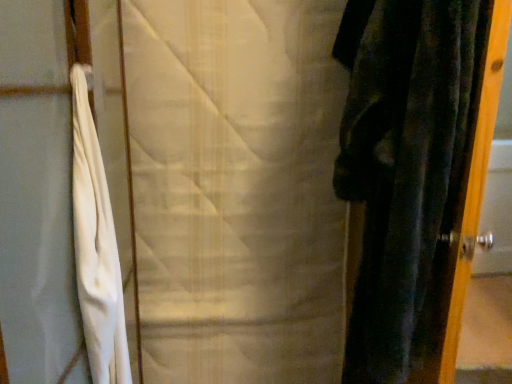
Locate an element on the screen. Image resolution: width=512 pixels, height=384 pixels. white textured fabric at center, which ranks as the 1th curtain in left-to-right order is located at coordinates (236, 189).

Describe the element at coordinates (236, 189) in the screenshot. The width and height of the screenshot is (512, 384). I see `white textured fabric at center, the second curtain when ordered from right to left` at that location.

Describe the element at coordinates (406, 171) in the screenshot. Image resolution: width=512 pixels, height=384 pixels. I see `velvet dark green curtain at right, the second curtain from the left` at that location.

How much space does velvet dark green curtain at right, which is the 1th curtain from right to left, occupy horizontally?

It is 4.70 inches.

What is the approximate height of velvet dark green curtain at right, the second curtain from the left?

velvet dark green curtain at right, the second curtain from the left, is 1.51 meters in height.

The image size is (512, 384). In order to click on velvet dark green curtain at right, which is the 1th curtain from right to left in this screenshot , I will do `click(406, 171)`.

Where is `white textured fabric at center, the second curtain when ordered from right to left`? The width and height of the screenshot is (512, 384). white textured fabric at center, the second curtain when ordered from right to left is located at coordinates (236, 189).

Which is more to the left, velvet dark green curtain at right, which is the 1th curtain from right to left, or white textured fabric at center, which ranks as the 1th curtain in left-to-right order?

Positioned to the left is white textured fabric at center, which ranks as the 1th curtain in left-to-right order.

Considering the positions of objects velvet dark green curtain at right, which is the 1th curtain from right to left, and white textured fabric at center, the second curtain when ordered from right to left, in the image provided, who is behind, velvet dark green curtain at right, which is the 1th curtain from right to left, or white textured fabric at center, the second curtain when ordered from right to left,?

white textured fabric at center, the second curtain when ordered from right to left, is more distant.

Considering the positions of points (420, 346) and (187, 322), is point (420, 346) farther from camera compared to point (187, 322)?

No, (420, 346) is closer to viewer.

From the picture: From the image's perspective, relative to white textured fabric at center, the second curtain when ordered from right to left, is velvet dark green curtain at right, which is the 1th curtain from right to left, above or below?

Based on their image positions, velvet dark green curtain at right, which is the 1th curtain from right to left, is located beneath white textured fabric at center, the second curtain when ordered from right to left.

From a real-world perspective, is velvet dark green curtain at right, the second curtain from the left, above or below white textured fabric at center, which ranks as the 1th curtain in left-to-right order?

velvet dark green curtain at right, the second curtain from the left, is situated higher than white textured fabric at center, which ranks as the 1th curtain in left-to-right order, in the real world.

Considering the relative sizes of velvet dark green curtain at right, which is the 1th curtain from right to left, and white textured fabric at center, the second curtain when ordered from right to left, in the image provided, is velvet dark green curtain at right, which is the 1th curtain from right to left, wider than white textured fabric at center, the second curtain when ordered from right to left,?

Indeed, velvet dark green curtain at right, which is the 1th curtain from right to left, has a greater width compared to white textured fabric at center, the second curtain when ordered from right to left.

In terms of height, does velvet dark green curtain at right, which is the 1th curtain from right to left, look taller or shorter compared to white textured fabric at center, the second curtain when ordered from right to left?

Considering their sizes, velvet dark green curtain at right, which is the 1th curtain from right to left, has more height than white textured fabric at center, the second curtain when ordered from right to left.

Considering the relative sizes of velvet dark green curtain at right, which is the 1th curtain from right to left, and white textured fabric at center, the second curtain when ordered from right to left, in the image provided, is velvet dark green curtain at right, which is the 1th curtain from right to left, smaller than white textured fabric at center, the second curtain when ordered from right to left,?

Yes.

Is white textured fabric at center, the second curtain when ordered from right to left, located within velvet dark green curtain at right, the second curtain from the left?

No, white textured fabric at center, the second curtain when ordered from right to left, is located outside of velvet dark green curtain at right, the second curtain from the left.

Is velvet dark green curtain at right, which is the 1th curtain from right to left, next to white textured fabric at center, the second curtain when ordered from right to left, and touching it?

velvet dark green curtain at right, which is the 1th curtain from right to left, is not next to white textured fabric at center, the second curtain when ordered from right to left, and they're not touching.

Is velvet dark green curtain at right, the second curtain from the left, looking in the opposite direction of white textured fabric at center, which ranks as the 1th curtain in left-to-right order?

Correct, velvet dark green curtain at right, the second curtain from the left, is looking away from white textured fabric at center, which ranks as the 1th curtain in left-to-right order.

Can you tell me how much velvet dark green curtain at right, the second curtain from the left, and white textured fabric at center, the second curtain when ordered from right to left, differ in facing direction?

There is a 75.2-degree angle between the facing directions of velvet dark green curtain at right, the second curtain from the left, and white textured fabric at center, the second curtain when ordered from right to left.

Where is `curtain in front of the white textured fabric at center, which ranks as the 1th curtain in left-to-right order`? curtain in front of the white textured fabric at center, which ranks as the 1th curtain in left-to-right order is located at coordinates (406, 171).

Looking at this image, which is more to the right, white textured fabric at center, which ranks as the 1th curtain in left-to-right order, or velvet dark green curtain at right, which is the 1th curtain from right to left?

Positioned to the right is velvet dark green curtain at right, which is the 1th curtain from right to left.

Which object is more forward, white textured fabric at center, the second curtain when ordered from right to left, or velvet dark green curtain at right, the second curtain from the left?

velvet dark green curtain at right, the second curtain from the left.

Does point (273, 338) come in front of point (412, 217)?

No, (273, 338) is further to viewer.

From the image's perspective, which one is positioned higher, white textured fabric at center, the second curtain when ordered from right to left, or velvet dark green curtain at right, which is the 1th curtain from right to left?

white textured fabric at center, the second curtain when ordered from right to left, is shown above in the image.

From a real-world perspective, which object rests below the other?

white textured fabric at center, the second curtain when ordered from right to left.

Can you confirm if white textured fabric at center, the second curtain when ordered from right to left, is wider than velvet dark green curtain at right, which is the 1th curtain from right to left?

Incorrect, the width of white textured fabric at center, the second curtain when ordered from right to left, does not surpass that of velvet dark green curtain at right, which is the 1th curtain from right to left.

In terms of height, does white textured fabric at center, which ranks as the 1th curtain in left-to-right order, look taller or shorter compared to velvet dark green curtain at right, which is the 1th curtain from right to left?

white textured fabric at center, which ranks as the 1th curtain in left-to-right order, is shorter than velvet dark green curtain at right, which is the 1th curtain from right to left.

Can you confirm if white textured fabric at center, which ranks as the 1th curtain in left-to-right order, is bigger than velvet dark green curtain at right, which is the 1th curtain from right to left?

Yes.

In the scene shown: Would you say white textured fabric at center, which ranks as the 1th curtain in left-to-right order, is outside velvet dark green curtain at right, the second curtain from the left?

That's correct, white textured fabric at center, which ranks as the 1th curtain in left-to-right order, is outside of velvet dark green curtain at right, the second curtain from the left.

Is white textured fabric at center, which ranks as the 1th curtain in left-to-right order, positioned far away from velvet dark green curtain at right, which is the 1th curtain from right to left?

white textured fabric at center, which ranks as the 1th curtain in left-to-right order, is near velvet dark green curtain at right, which is the 1th curtain from right to left, not far away.

Is white textured fabric at center, which ranks as the 1th curtain in left-to-right order, turned away from velvet dark green curtain at right, the second curtain from the left?

That's not correct — white textured fabric at center, which ranks as the 1th curtain in left-to-right order, is not looking away from velvet dark green curtain at right, the second curtain from the left.

Measure the distance between white textured fabric at center, the second curtain when ordered from right to left, and velvet dark green curtain at right, which is the 1th curtain from right to left.

The distance of white textured fabric at center, the second curtain when ordered from right to left, from velvet dark green curtain at right, which is the 1th curtain from right to left, is 18.40 inches.

Identify the location of curtain below the white textured fabric at center, the second curtain when ordered from right to left (from the image's perspective). This screenshot has width=512, height=384. (406, 171).

The image size is (512, 384). I want to click on curtain above the white textured fabric at center, which ranks as the 1th curtain in left-to-right order (from a real-world perspective), so click(406, 171).

This screenshot has height=384, width=512. What are the coordinates of `curtain behind the velvet dark green curtain at right, which is the 1th curtain from right to left` in the screenshot? It's located at (236, 189).